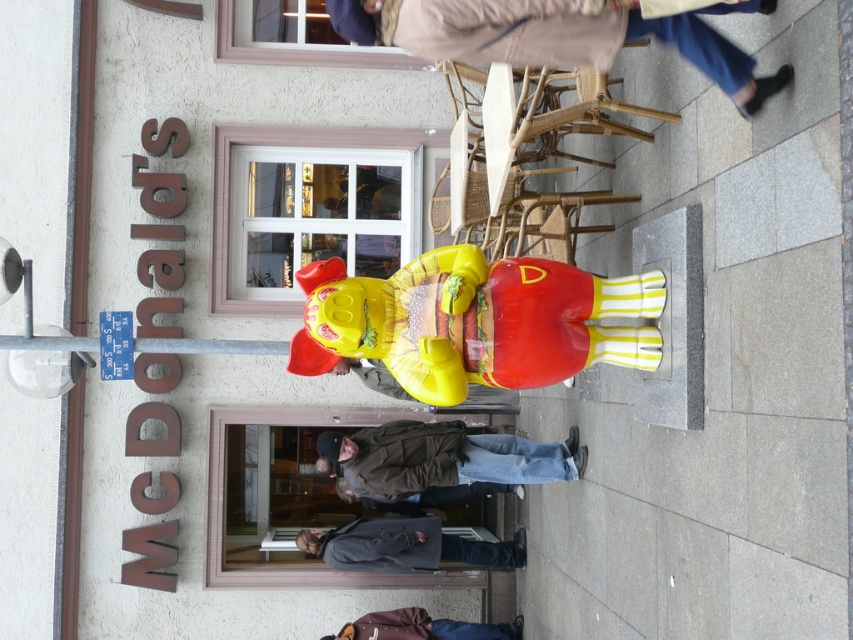
You are a customer standing outside the McDonalds entrance. You see a wooden stool at center and a brown leather jacket at lower center. Which object is shorter?

The wooden stool at center is shorter than the brown leather jacket at lower center.